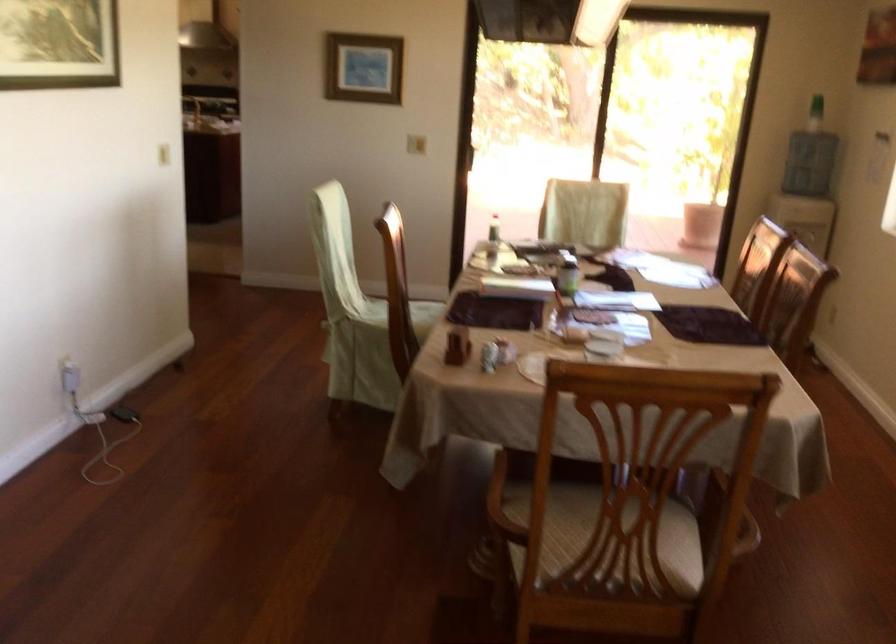
The height and width of the screenshot is (644, 896). In order to click on white patterned mug in this screenshot , I will do 316,540.